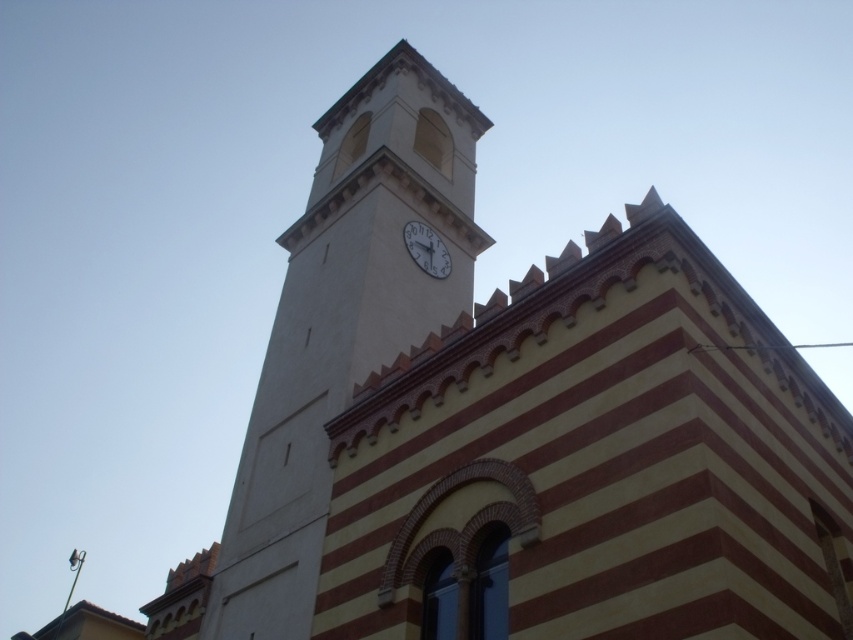
You are an architect inspecting the building design. You notice the white smooth clock tower at upper center and the white glossy clock at center. Which one is located to the left of the other?

The white smooth clock tower at upper center is positioned on the left side of white glossy clock at center.

You are standing in front of the building and want to take a photo of the white smooth clock tower at upper center and the white glossy clock at center. Which one will appear larger in your photo?

The white smooth clock tower at upper center will appear larger in the photo because it is closer to the viewer than the white glossy clock at center.